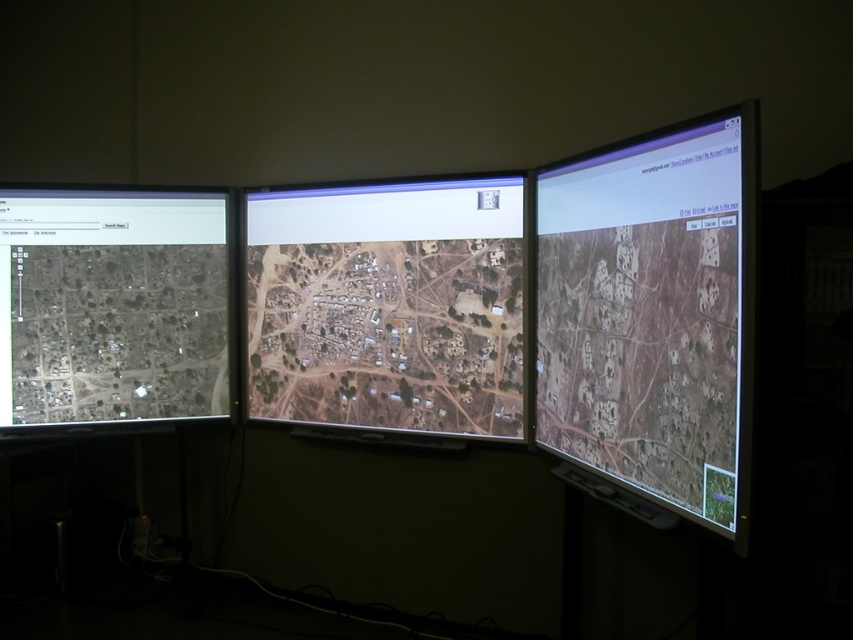
You are a city planner reviewing the layout of the village. You need to compare the satellite imagery map at center and the gray matte map at left. Which map is located to the right of the other?

The satellite imagery map at center is positioned on the right side of gray matte map at left.

You are analyzing the satellite imagery on the three monitors. The left monitor shows a broader view, while the middle one is zoomed in on the village center. You notice two points marked on the middle monitor at coordinates point (682, 454) and point (136, 392). Which point is closer to the viewer in the middle monitor?

Point (682, 454) is in front of point (136, 392) on the middle monitor, so it is closer to the viewer.

You are a technician checking the arrangement of two monitors in a control room. You have the matte black monitor at right and the gray matte map at left. According to the scene, which monitor is positioned lower?

The matte black monitor at right is positioned lower than the gray matte map at left because it is described as being below it.